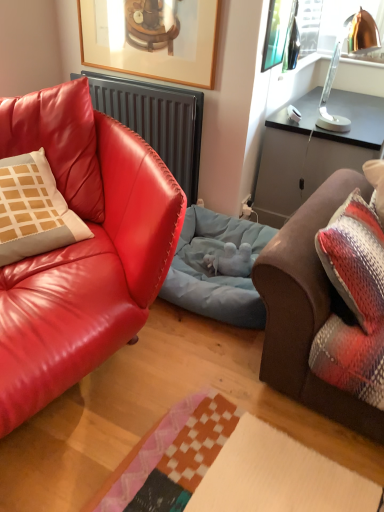
Describe the element at coordinates (34, 210) in the screenshot. The height and width of the screenshot is (512, 384). I see `matte white pillow with brown grid at left` at that location.

Describe the element at coordinates (156, 121) in the screenshot. I see `matte black radiator at left` at that location.

What is the approximate height of brown leather couch at right, which appears as the first studio couch when viewed from the right?

It is 56.65 centimeters.

What are the coordinates of `matte red leather couch at left, marked as the 2th studio couch in a right-to-left arrangement` in the screenshot? It's located at (82, 248).

Is matte black radiator at left positioned behind copper metallic lamp at upper right?

Yes, matte black radiator at left is further from the camera.

Who is taller, matte black radiator at left or copper metallic lamp at upper right?

matte black radiator at left.

Is matte black radiator at left situated inside copper metallic lamp at upper right or outside?

matte black radiator at left cannot be found inside copper metallic lamp at upper right.

Considering the sizes of objects matte black radiator at left and copper metallic lamp at upper right in the image provided, who is bigger, matte black radiator at left or copper metallic lamp at upper right?

Bigger between the two is matte black radiator at left.

Find the location of a particular element. The height and width of the screenshot is (512, 384). studio couch that is the 1st object located in front of the wooden framed picture at upper center is located at coordinates (308, 308).

Is wooden framed picture at upper center spatially inside brown leather couch at right, which appears as the first studio couch when viewed from the right, or outside of it?

wooden framed picture at upper center is outside brown leather couch at right, which appears as the first studio couch when viewed from the right.

Is wooden framed picture at upper center positioned far away from brown leather couch at right, which appears as the first studio couch when viewed from the right?

Indeed, wooden framed picture at upper center is not near brown leather couch at right, which appears as the first studio couch when viewed from the right.

In the scene shown: Considering the positions of objects wooden framed picture at upper center and brown leather couch at right, the 2th studio couch from the left, in the image provided, who is more to the right, wooden framed picture at upper center or brown leather couch at right, the 2th studio couch from the left,?

From the viewer's perspective, brown leather couch at right, the 2th studio couch from the left, appears more on the right side.

Choose the correct answer: Is copper metallic lamp at upper right inside matte white pillow with brown grid at left or outside it?

copper metallic lamp at upper right lies outside matte white pillow with brown grid at left.

In terms of width, does copper metallic lamp at upper right look wider or thinner when compared to matte white pillow with brown grid at left?

Clearly, copper metallic lamp at upper right has less width compared to matte white pillow with brown grid at left.

Is copper metallic lamp at upper right looking in the opposite direction of matte white pillow with brown grid at left?

No.

How many degrees apart are the facing directions of copper metallic lamp at upper right and matte white pillow with brown grid at left?

The angle between the facing direction of copper metallic lamp at upper right and the facing direction of matte white pillow with brown grid at left is 29.6 degrees.

Is light blue fabric dog bed at center to the right of matte red leather couch at left, the first studio couch from the left, from the viewer's perspective?

Yes.

Is point (180, 296) closer or farther from the camera than point (144, 278)?

Point (180, 296) appears to be farther away from the viewer than point (144, 278).

Is the depth of light blue fabric dog bed at center greater than that of matte red leather couch at left, marked as the 2th studio couch in a right-to-left arrangement?

Yes, it is.

The width and height of the screenshot is (384, 512). What are the coordinates of `radiator on the left of wooden framed picture at upper center` in the screenshot? It's located at (156, 121).

Consider the image. From a real-world perspective, is wooden framed picture at upper center physically below matte black radiator at left?

Incorrect, from a real-world perspective, wooden framed picture at upper center is higher than matte black radiator at left.

Considering the sizes of wooden framed picture at upper center and matte black radiator at left in the image, is wooden framed picture at upper center wider or thinner than matte black radiator at left?

In the image, wooden framed picture at upper center appears to be more narrow than matte black radiator at left.

Does copper metallic lamp at upper right touch matte red leather couch at left, marked as the 2th studio couch in a right-to-left arrangement?

No, copper metallic lamp at upper right is not with matte red leather couch at left, marked as the 2th studio couch in a right-to-left arrangement.

Is copper metallic lamp at upper right taller than matte red leather couch at left, the first studio couch from the left?

No.

Which is further, [330,73] or [73,149]?

Point [330,73]

Based on their sizes in the image, would you say copper metallic lamp at upper right is bigger or smaller than matte red leather couch at left, marked as the 2th studio couch in a right-to-left arrangement?

copper metallic lamp at upper right is smaller than matte red leather couch at left, marked as the 2th studio couch in a right-to-left arrangement.

Considering the sizes of objects matte white pillow with brown grid at left and matte black radiator at left in the image provided, who is shorter, matte white pillow with brown grid at left or matte black radiator at left?

matte white pillow with brown grid at left.

Which object is further away from the camera taking this photo, matte white pillow with brown grid at left or matte black radiator at left?

matte black radiator at left is more distant.

You are a GUI agent. You are given a task and a screenshot of the screen. Output one action in this format:
    pyautogui.click(x=<x>, y=<y>)
    Task: Click on the pillow in front of the matte black radiator at left
    The image size is (384, 512).
    Given the screenshot: What is the action you would take?
    pyautogui.click(x=34, y=210)

Identify the location of lamp above the matte black radiator at left (from the image's perspective). (339, 58).

The height and width of the screenshot is (512, 384). What are the coordinates of `picture frame on the left of the brown leather couch at right, which appears as the first studio couch when viewed from the right` in the screenshot? It's located at (151, 38).

Estimate the real-world distances between objects in this image. Which object is further from matte white pillow with brown grid at left, light blue fabric dog bed at center or matte black radiator at left?

matte black radiator at left lies further to matte white pillow with brown grid at left than the other object.

Looking at the image, which one is located closer to matte red leather couch at left, marked as the 2th studio couch in a right-to-left arrangement, wooden framed picture at upper center or copper metallic lamp at upper right?

wooden framed picture at upper center lies closer to matte red leather couch at left, marked as the 2th studio couch in a right-to-left arrangement, than the other object.

Estimate the real-world distances between objects in this image. Which object is closer to light blue fabric dog bed at center, brown leather couch at right, the 2th studio couch from the left, or wooden framed picture at upper center?

Among the two, brown leather couch at right, the 2th studio couch from the left, is located nearer to light blue fabric dog bed at center.

When comparing their distances from brown leather couch at right, which appears as the first studio couch when viewed from the right, does matte red leather couch at left, marked as the 2th studio couch in a right-to-left arrangement, or copper metallic lamp at upper right seem closer?

Based on the image, matte red leather couch at left, marked as the 2th studio couch in a right-to-left arrangement, appears to be nearer to brown leather couch at right, which appears as the first studio couch when viewed from the right.

Considering their positions, is matte red leather couch at left, marked as the 2th studio couch in a right-to-left arrangement, positioned further to wooden framed picture at upper center than light blue fabric dog bed at center?

Among the two, light blue fabric dog bed at center is located further to wooden framed picture at upper center.

In the scene shown: Which object lies nearer to the anchor point matte red leather couch at left, the first studio couch from the left, matte white pillow with brown grid at left or light blue fabric dog bed at center?

matte white pillow with brown grid at left is positioned closer to the anchor matte red leather couch at left, the first studio couch from the left.

Looking at the image, which one is located further to light blue fabric dog bed at center, wooden framed picture at upper center or matte red leather couch at left, the first studio couch from the left?

Based on the image, wooden framed picture at upper center appears to be further to light blue fabric dog bed at center.

When comparing their distances from matte white pillow with brown grid at left, does copper metallic lamp at upper right or matte black radiator at left seem closer?

Among the two, matte black radiator at left is located nearer to matte white pillow with brown grid at left.

The image size is (384, 512). Identify the location of studio couch between matte red leather couch at left, the first studio couch from the left, and copper metallic lamp at upper right, in the horizontal direction. (308, 308).

The height and width of the screenshot is (512, 384). Identify the location of picture frame located between matte black radiator at left and copper metallic lamp at upper right in the left-right direction. (151, 38).

Image resolution: width=384 pixels, height=512 pixels. I want to click on studio couch located between matte black radiator at left and copper metallic lamp at upper right in the left-right direction, so click(x=308, y=308).

The image size is (384, 512). In order to click on radiator between matte white pillow with brown grid at left and light blue fabric dog bed at center in the horizontal direction in this screenshot , I will do click(x=156, y=121).